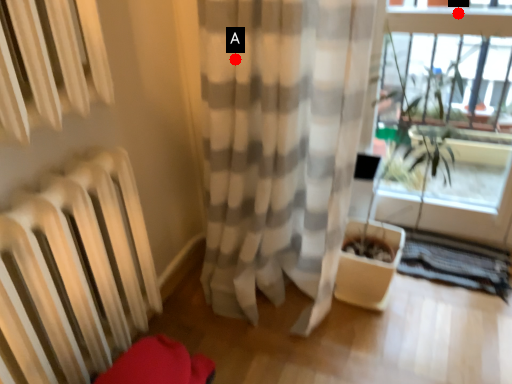
Question: Two points are circled on the image, labeled by A and B beside each circle. Which point is further to the camera?

Choices:
 (A) A is further
 (B) B is further

Answer: (B)